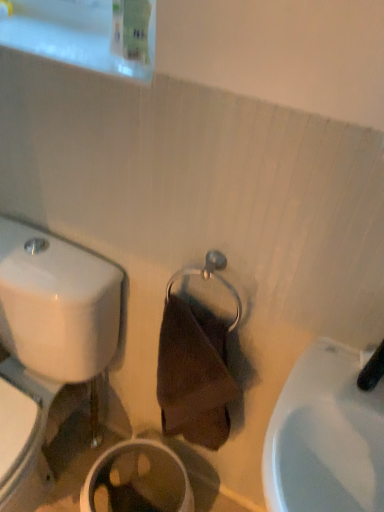
Question: Should I look upward or downward to see white glossy toilet at left?

Choices:
 (A) up
 (B) down

Answer: (B)

Question: Is white glossy toilet at left not inside black rubber faucet at upper right?

Choices:
 (A) yes
 (B) no

Answer: (A)

Question: Considering the relative positions of white glossy toilet at left and black rubber faucet at upper right in the image provided, is white glossy toilet at left to the right of black rubber faucet at upper right from the viewer's perspective?

Choices:
 (A) yes
 (B) no

Answer: (B)

Question: Considering the relative sizes of white glossy toilet at left and black rubber faucet at upper right in the image provided, is white glossy toilet at left smaller than black rubber faucet at upper right?

Choices:
 (A) yes
 (B) no

Answer: (B)

Question: Does white glossy toilet at left have a lesser width compared to black rubber faucet at upper right?

Choices:
 (A) yes
 (B) no

Answer: (B)

Question: Is white glossy toilet at left next to black rubber faucet at upper right?

Choices:
 (A) yes
 (B) no

Answer: (B)

Question: From a real-world perspective, is white glossy toilet at left positioned over black rubber faucet at upper right based on gravity?

Choices:
 (A) no
 (B) yes

Answer: (A)

Question: From the image's perspective, is black rubber faucet at upper right below white glossy toilet at left?

Choices:
 (A) no
 (B) yes

Answer: (A)

Question: Considering the relative positions of black rubber faucet at upper right and white glossy toilet at left in the image provided, is black rubber faucet at upper right to the left of white glossy toilet at left from the viewer's perspective?

Choices:
 (A) yes
 (B) no

Answer: (B)

Question: Does black rubber faucet at upper right have a larger size compared to white glossy toilet at left?

Choices:
 (A) yes
 (B) no

Answer: (B)

Question: Is white glossy toilet at left surrounded by black rubber faucet at upper right?

Choices:
 (A) no
 (B) yes

Answer: (A)

Question: From the image's perspective, does black rubber faucet at upper right appear higher than white glossy toilet at left?

Choices:
 (A) yes
 (B) no

Answer: (A)

Question: Is black rubber faucet at upper right placed right next to white glossy toilet at left?

Choices:
 (A) yes
 (B) no

Answer: (B)

Question: Is white glossy toilet at left not near white glossy sink at lower right?

Choices:
 (A) no
 (B) yes

Answer: (A)